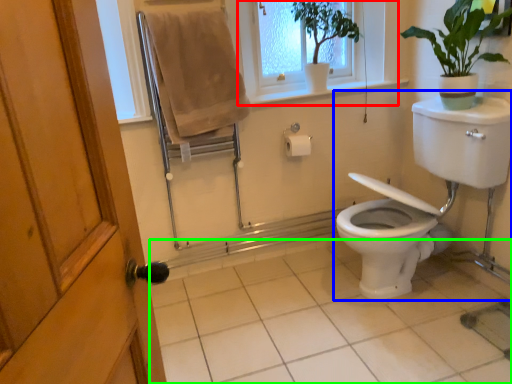
Question: Considering the real-world distances, which object is farthest from window frame (highlighted by a red box)? sink (highlighted by a blue box) or tile (highlighted by a green box)?

Choices:
 (A) sink
 (B) tile

Answer: (B)